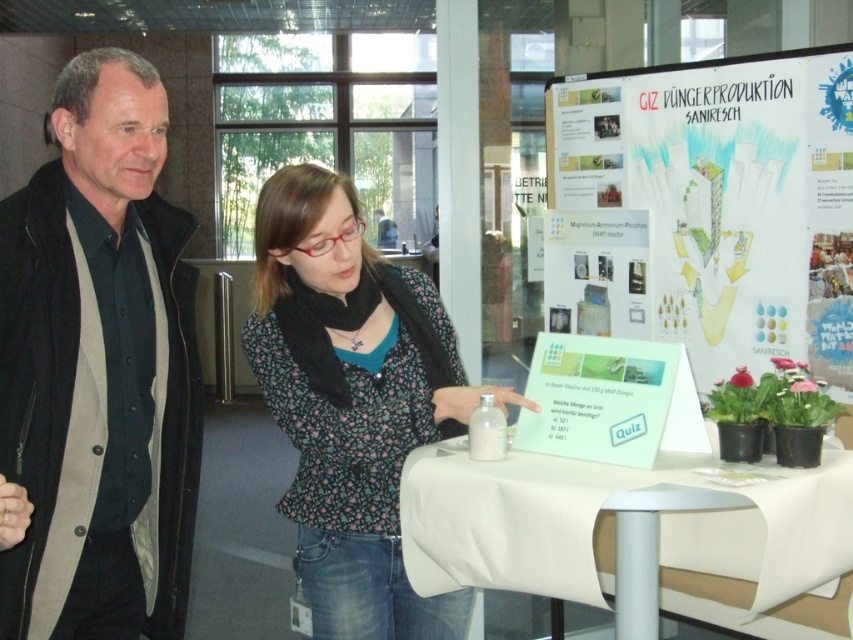
Can you confirm if black matte jacket at left is positioned below floral fabric blouse at center?

Incorrect, black matte jacket at left is not positioned below floral fabric blouse at center.

Locate an element on the screen. black matte jacket at left is located at coordinates (99, 369).

Does black matte jacket at left appear on the right side of white fabric table at center?

Incorrect, black matte jacket at left is not on the right side of white fabric table at center.

Does black matte jacket at left have a lesser width compared to white fabric table at center?

Yes, black matte jacket at left is thinner than white fabric table at center.

Who is more distant from viewer, (96, 209) or (534, 570)?

Positioned behind is point (96, 209).

Find the location of a particular element. The height and width of the screenshot is (640, 853). black matte jacket at left is located at coordinates [99, 369].

Can you confirm if white paperboard at upper center is smaller than white fabric table at center?

No.

Can you confirm if white paperboard at upper center is thinner than white fabric table at center?

Indeed, white paperboard at upper center has a lesser width compared to white fabric table at center.

Is point (764, 104) positioned after point (837, 458)?

Yes, point (764, 104) is farther from viewer.

I want to click on white paperboard at upper center, so click(726, 198).